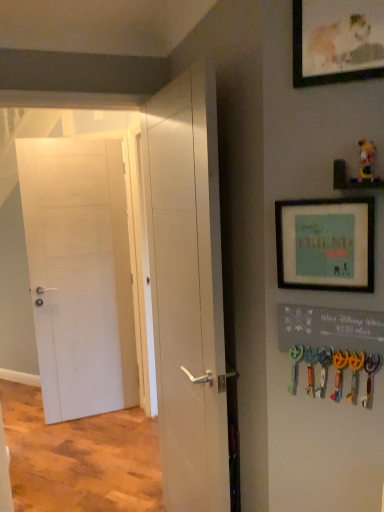
In order to click on free spot below white matte door at left, the 2th door viewed from the right (from a real-world perspective) in this screenshot , I will do click(x=103, y=414).